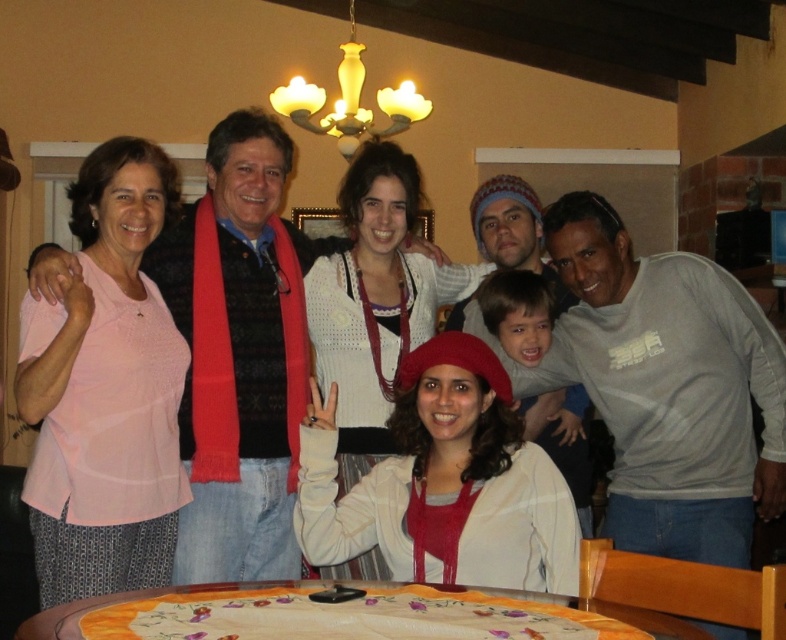
Image resolution: width=786 pixels, height=640 pixels. Describe the element at coordinates (239, 353) in the screenshot. I see `pink fabric shirt at left` at that location.

Who is more forward, (256,179) or (324,124)?

Positioned in front is point (256,179).

The width and height of the screenshot is (786, 640). What are the coordinates of `pink fabric shirt at left` in the screenshot? It's located at (239, 353).

Which is more to the left, gray cotton shirt at center or pink fabric shirt at left?

pink fabric shirt at left

Is gray cotton shirt at center thinner than pink fabric shirt at left?

In fact, gray cotton shirt at center might be wider than pink fabric shirt at left.

Where is `gray cotton shirt at center`? gray cotton shirt at center is located at coordinates tap(667, 387).

Is embroidered fabric table at center behind ivory matte chandelier at upper center?

That is False.

Does embroidered fabric table at center appear on the left side of ivory matte chandelier at upper center?

Incorrect, embroidered fabric table at center is not on the left side of ivory matte chandelier at upper center.

Which is behind, point (119, 608) or point (278, 106)?

The point (278, 106) is more distant.

Where is `embroidered fabric table at center`? This screenshot has height=640, width=786. embroidered fabric table at center is located at coordinates (138, 609).